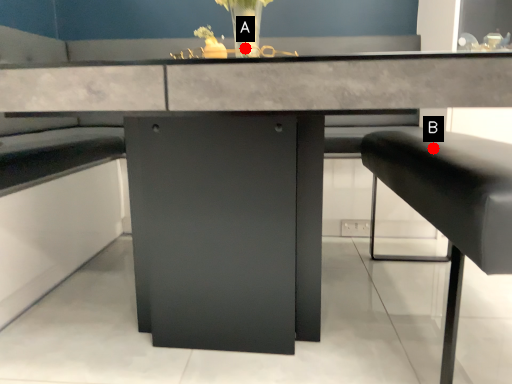
Question: Two points are circled on the image, labeled by A and B beside each circle. Among these points, which one is farthest from the camera?

Choices:
 (A) A is further
 (B) B is further

Answer: (A)